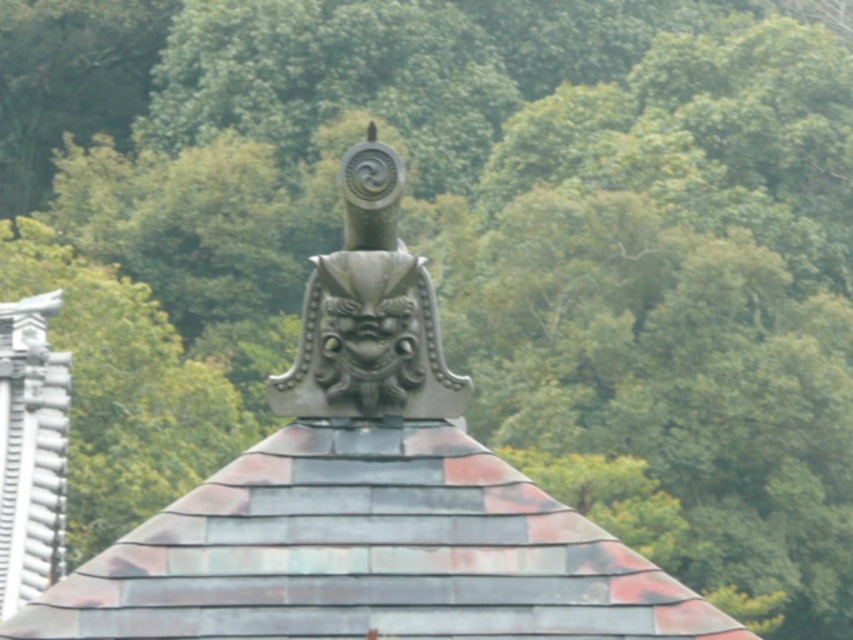
Question: Is shiny copper tiles at center positioned at the back of metallic gray dragon head at center?

Choices:
 (A) no
 (B) yes

Answer: (A)

Question: Does shiny copper tiles at center have a larger size compared to metallic gray dragon head at center?

Choices:
 (A) no
 (B) yes

Answer: (A)

Question: Which point is farther from the camera taking this photo?

Choices:
 (A) (299, 600)
 (B) (317, 412)

Answer: (B)

Question: Which point appears farthest from the camera in this image?

Choices:
 (A) tap(352, 252)
 (B) tap(318, 435)

Answer: (A)

Question: Is shiny copper tiles at center wider than metallic gray dragon head at center?

Choices:
 (A) yes
 (B) no

Answer: (A)